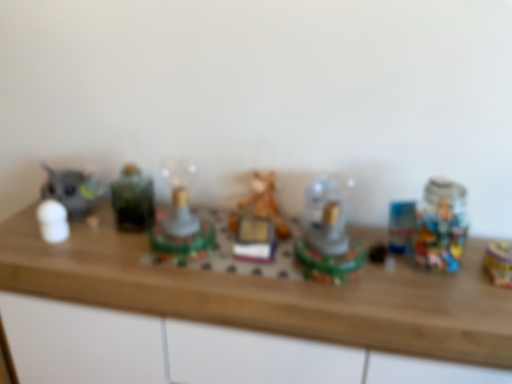
Find the location of a particular element. The image size is (512, 384). vacant region in front of gold metallic toy at right, the 7th toy positioned from the left is located at coordinates (489, 304).